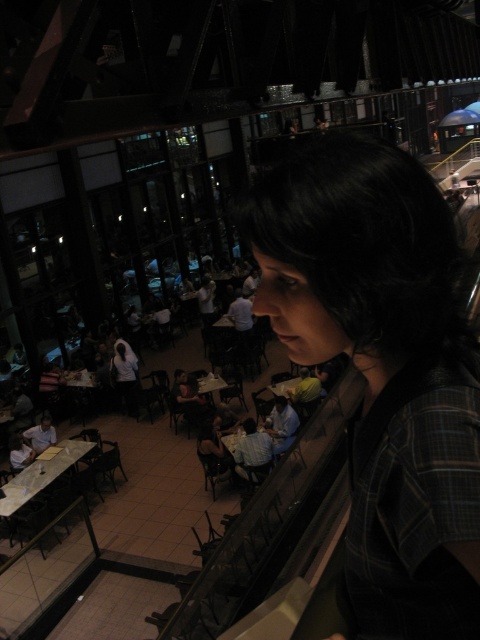
Is wooden table at center bigger than white glossy table at center?

Actually, wooden table at center might be smaller than white glossy table at center.

Does point (283, 442) come behind point (197, 387)?

That is False.

At what (x,y) coordinates should I click in order to perform the action: click on wooden table at center. Please return your answer as a coordinate pair (x, y). Looking at the image, I should click on (x=282, y=440).

At what (x,y) coordinates should I click in order to perform the action: click on wooden table at center. Please return your answer as a coordinate pair (x, y). This screenshot has height=640, width=480. Looking at the image, I should click on (282, 440).

Does plaid fabric shirt at center come behind white glossy table at lower left?

No, plaid fabric shirt at center is closer to the viewer.

Does point (410, 538) lie behind point (21, 500)?

No, (410, 538) is closer to viewer.

Image resolution: width=480 pixels, height=640 pixels. In order to click on plaid fabric shirt at center in this screenshot , I will do pyautogui.click(x=384, y=369).

What do you see at coordinates (384, 369) in the screenshot? I see `plaid fabric shirt at center` at bounding box center [384, 369].

From the picture: Is plaid fabric shirt at center positioned in front of white glossy table at center?

Yes, it is in front of white glossy table at center.

Is point (456, 509) closer to viewer compared to point (212, 387)?

Yes, point (456, 509) is closer to viewer.

At what (x,y) coordinates should I click in order to perform the action: click on plaid fabric shirt at center. Please return your answer as a coordinate pair (x, y). This screenshot has width=480, height=640. Looking at the image, I should click on (384, 369).